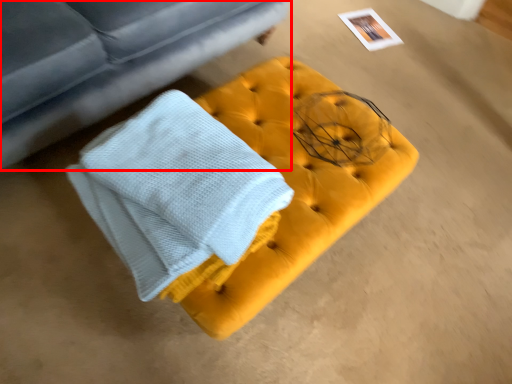
Question: From the image's perspective, where is studio couch (annotated by the red box) located relative to furniture?

Choices:
 (A) below
 (B) above

Answer: (B)